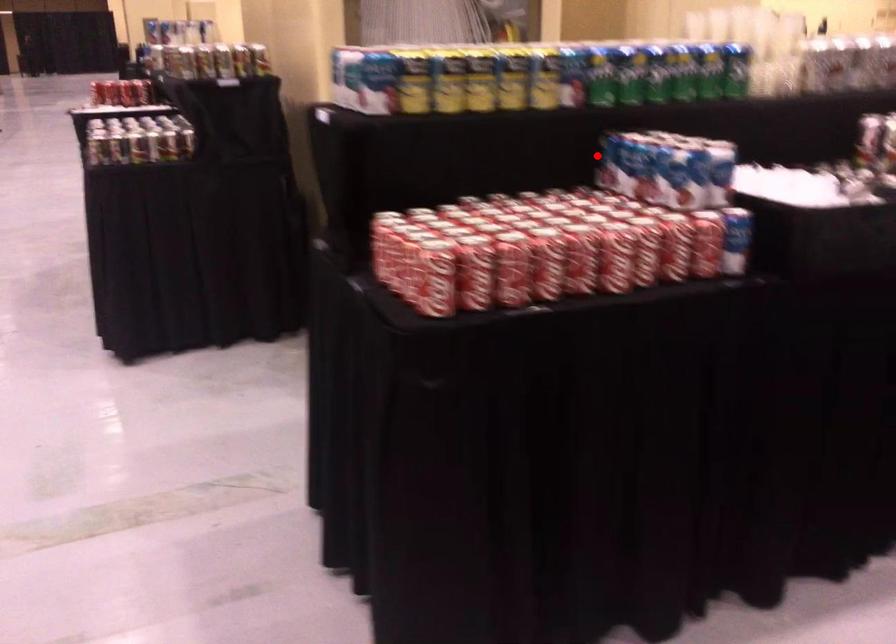
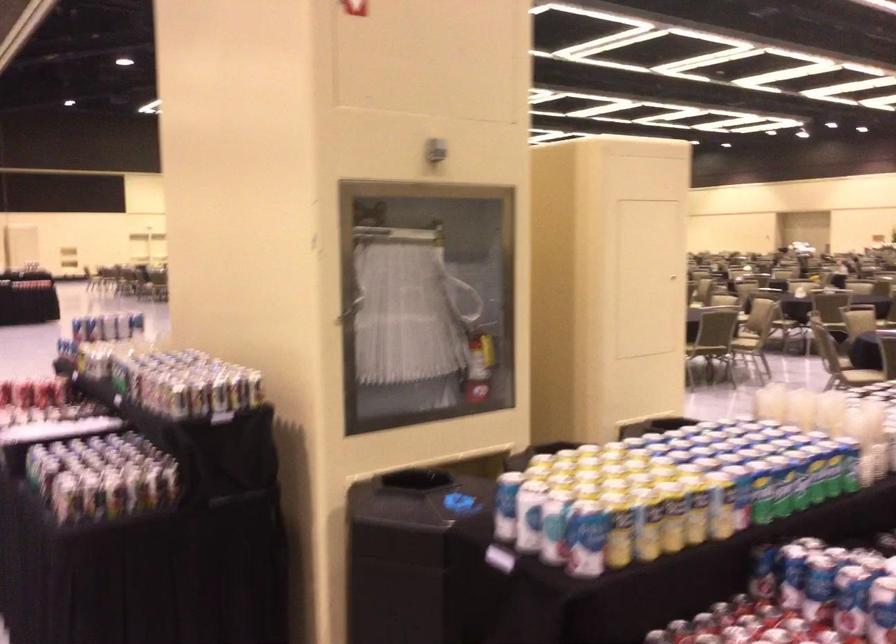
The point at the highlighted location is marked in the first image. Where is the corresponding point in the second image?

(762, 572)